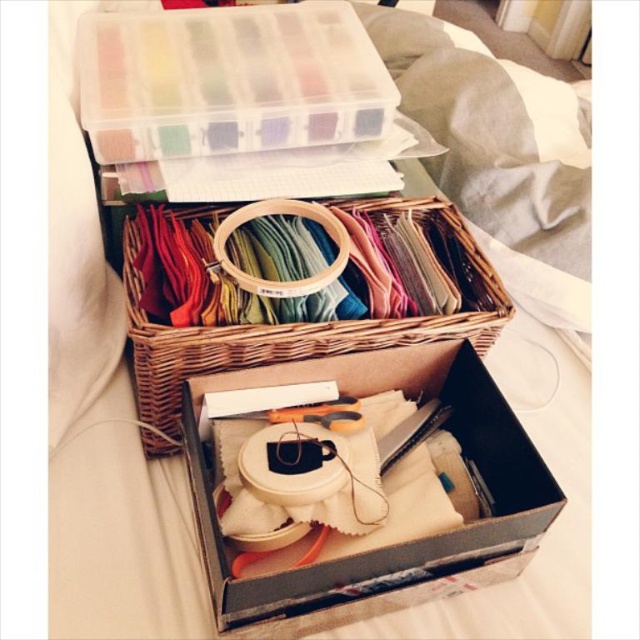
Does white cardboard box at center appear on the right side of woven wood basket at center?

Correct, you'll find white cardboard box at center to the right of woven wood basket at center.

Is point (289, 577) closer to camera compared to point (136, 381)?

Yes, point (289, 577) is in front of point (136, 381).

Where is `white cardboard box at center`? The width and height of the screenshot is (640, 640). white cardboard box at center is located at coordinates (401, 544).

Which is below, clear plastic container at upper center or woven wood basket at center?

woven wood basket at center is below.

Can you confirm if clear plastic container at upper center is positioned to the left of woven wood basket at center?

Yes, clear plastic container at upper center is to the left of woven wood basket at center.

What do you see at coordinates (228, 81) in the screenshot?
I see `clear plastic container at upper center` at bounding box center [228, 81].

Image resolution: width=640 pixels, height=640 pixels. What are the coordinates of `clear plastic container at upper center` in the screenshot? It's located at (228, 81).

Does clear plastic container at upper center have a greater height compared to white cardboard box at center?

Yes, clear plastic container at upper center is taller than white cardboard box at center.

Who is more forward, (157,36) or (419,355)?

Point (419,355) is more forward.

Identify the location of clear plastic container at upper center. Image resolution: width=640 pixels, height=640 pixels. (228, 81).